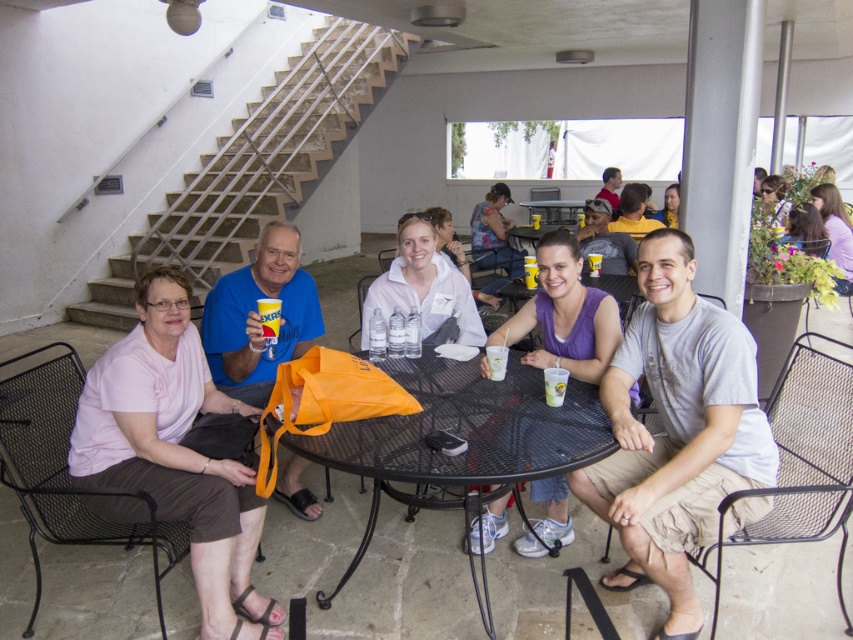
Question: Does black mesh table at center lie in front of orange fabric bag at center?

Choices:
 (A) no
 (B) yes

Answer: (B)

Question: Which object is the farthest from the black mesh table at center?

Choices:
 (A) orange fabric bag at center
 (B) gray cotton shirt at center
 (C) pink fabric shirt at left
 (D) purple fabric tank top at center

Answer: (A)

Question: Which object is closer to the camera taking this photo?

Choices:
 (A) black mesh table at center
 (B) gray cotton shirt at center

Answer: (A)

Question: Observing the image, what is the correct spatial positioning of gray cotton shirt at center in reference to purple fabric tank top at center?

Choices:
 (A) above
 (B) below

Answer: (B)

Question: Does gray cotton shirt at center have a greater width compared to orange fabric bag at center?

Choices:
 (A) yes
 (B) no

Answer: (A)

Question: Estimate the real-world distances between objects in this image. Which object is farther from the purple fabric tank top at center?

Choices:
 (A) orange fabric bag at center
 (B) gray cotton shirt at center

Answer: (A)